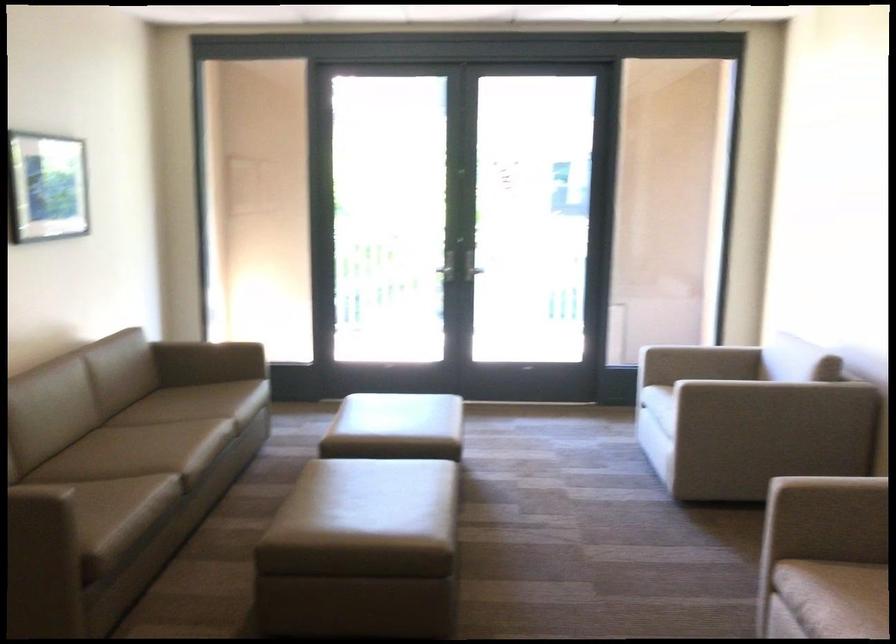
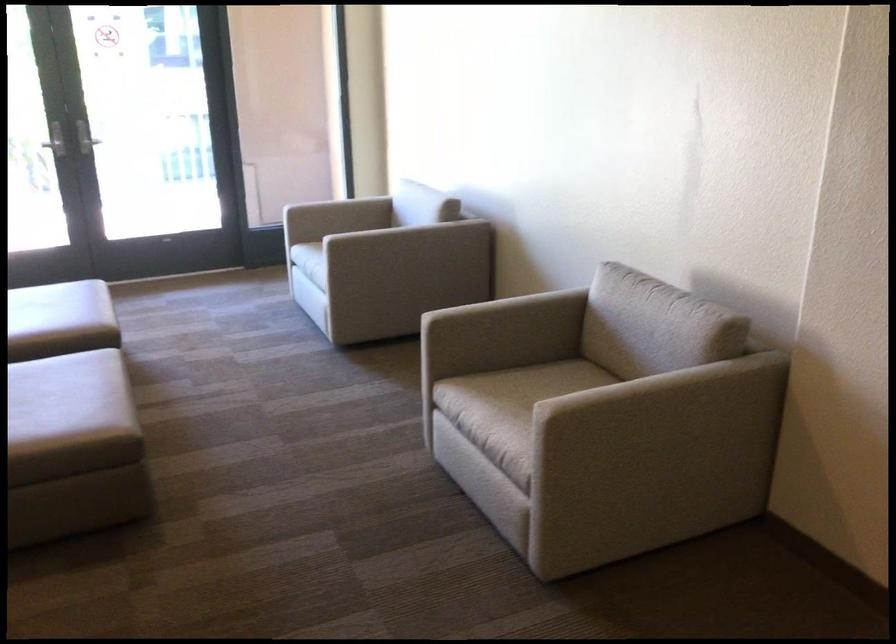
Question: What movement of the cameraman would produce the second image?

Choices:
 (A) Left
 (B) Right
 (C) Forward
 (D) Backward

Answer: (D)